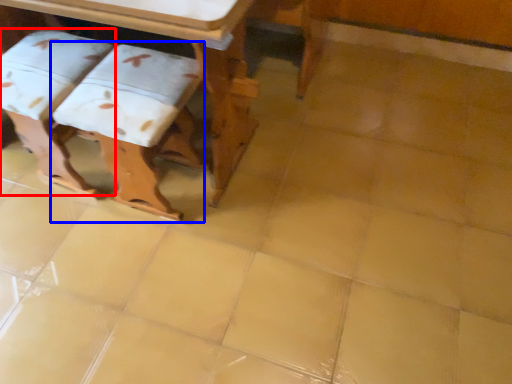
Question: Which object is closer to the camera taking this photo, step stool (highlighted by a red box) or step stool (highlighted by a blue box)?

Choices:
 (A) step stool
 (B) step stool

Answer: (B)